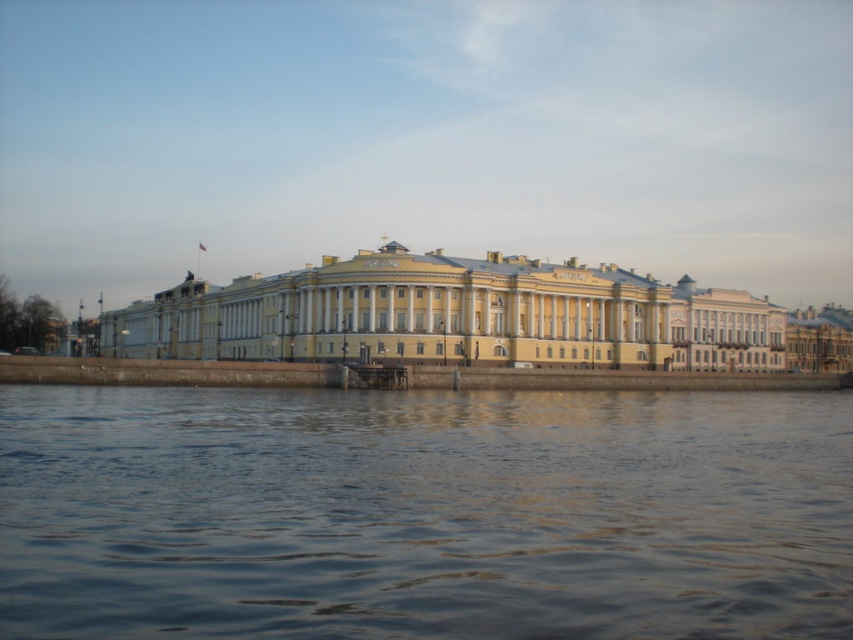
Question: Is blue water at lower center to the right of yellow matte building at center from the viewer's perspective?

Choices:
 (A) yes
 (B) no

Answer: (B)

Question: Which of the following is the closest to the observer?

Choices:
 (A) (297, 308)
 (B) (656, 419)

Answer: (B)

Question: Which object is farther from the camera taking this photo?

Choices:
 (A) yellow matte building at center
 (B) blue water at lower center

Answer: (A)

Question: Is blue water at lower center smaller than yellow matte building at center?

Choices:
 (A) yes
 (B) no

Answer: (A)

Question: Is blue water at lower center thinner than yellow matte building at center?

Choices:
 (A) no
 (B) yes

Answer: (B)